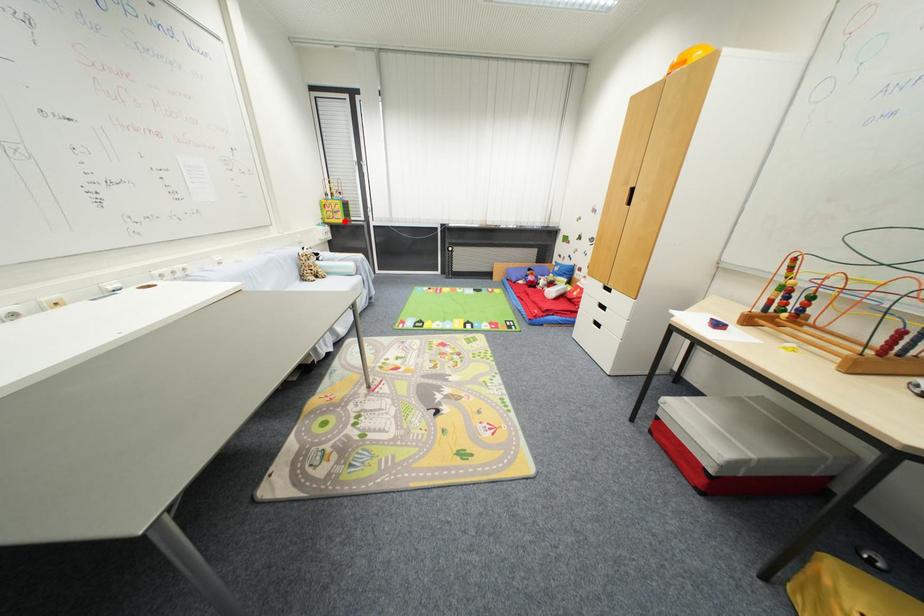
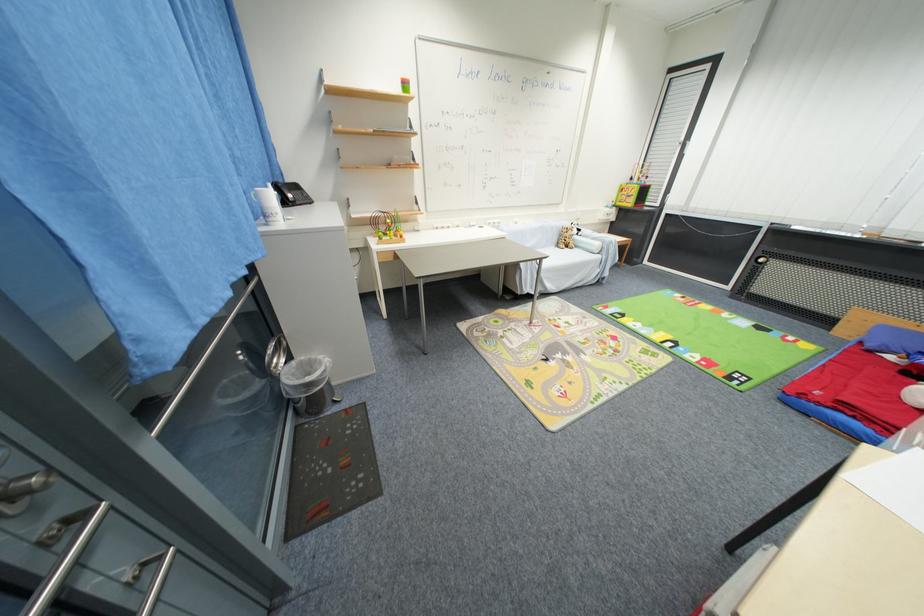
The point at the highlighted location is marked in the first image. Where is the corresponding point in the second image?

(635, 206)